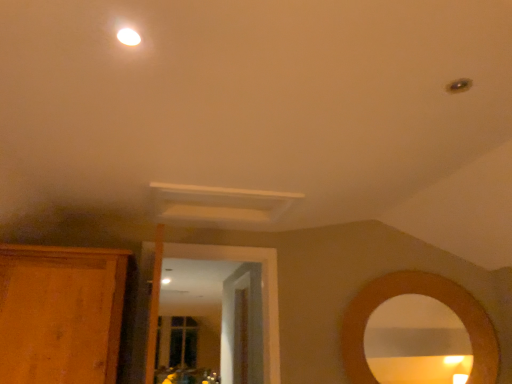
Question: From a real-world perspective, is wooden door at center positioned over wooden cabinet at left based on gravity?

Choices:
 (A) no
 (B) yes

Answer: (A)

Question: Can you confirm if wooden door at center is bigger than wooden cabinet at left?

Choices:
 (A) yes
 (B) no

Answer: (B)

Question: Does wooden door at center contain wooden cabinet at left?

Choices:
 (A) yes
 (B) no

Answer: (B)

Question: Could you tell me if wooden door at center is facing wooden cabinet at left?

Choices:
 (A) no
 (B) yes

Answer: (A)

Question: Does wooden door at center appear on the left side of wooden cabinet at left?

Choices:
 (A) yes
 (B) no

Answer: (B)

Question: Can you confirm if wooden door at center is thinner than wooden cabinet at left?

Choices:
 (A) no
 (B) yes

Answer: (B)

Question: From a real-world perspective, does white glossy light fixture at upper center stand above wooden cabinet at left?

Choices:
 (A) yes
 (B) no

Answer: (A)

Question: From a real-world perspective, does white glossy light fixture at upper center sit lower than wooden cabinet at left?

Choices:
 (A) no
 (B) yes

Answer: (A)

Question: Is white glossy light fixture at upper center shorter than wooden cabinet at left?

Choices:
 (A) yes
 (B) no

Answer: (A)

Question: Is white glossy light fixture at upper center completely or partially outside of wooden cabinet at left?

Choices:
 (A) yes
 (B) no

Answer: (A)

Question: Considering the relative positions of white glossy light fixture at upper center and wooden cabinet at left in the image provided, is white glossy light fixture at upper center to the left of wooden cabinet at left from the viewer's perspective?

Choices:
 (A) no
 (B) yes

Answer: (A)

Question: Would you say wooden cabinet at left is part of white glossy light fixture at upper center's contents?

Choices:
 (A) no
 (B) yes

Answer: (A)

Question: Is wooden cabinet at left shorter than wooden door at center?

Choices:
 (A) no
 (B) yes

Answer: (B)